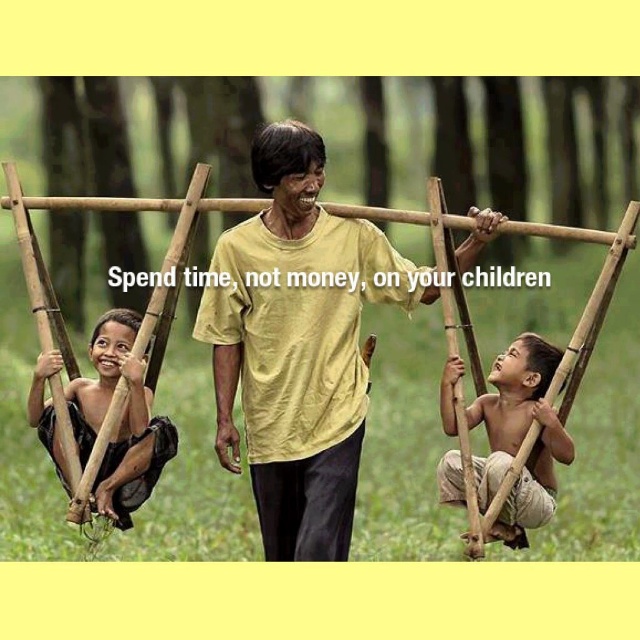
Can you confirm if brown skin child at center is thinner than black fabric child at left?

Correct, brown skin child at center's width is less than black fabric child at left's.

Between brown skin child at center and black fabric child at left, which one is positioned higher?

black fabric child at left is higher up.

Describe the element at coordinates (518, 436) in the screenshot. The width and height of the screenshot is (640, 640). I see `brown skin child at center` at that location.

This screenshot has height=640, width=640. Find the location of `brown skin child at center`. brown skin child at center is located at coordinates (518, 436).

Who is positioned more to the left, yellow cotton shirt at center or brown skin child at center?

From the viewer's perspective, yellow cotton shirt at center appears more on the left side.

Can you confirm if yellow cotton shirt at center is thinner than brown skin child at center?

In fact, yellow cotton shirt at center might be wider than brown skin child at center.

Consider the image. Who is more distant from viewer, (358, 374) or (547, 465)?

Point (358, 374)

In order to click on yellow cotton shirt at center in this screenshot , I will do `click(298, 344)`.

The height and width of the screenshot is (640, 640). Describe the element at coordinates (298, 344) in the screenshot. I see `yellow cotton shirt at center` at that location.

Which is more to the right, yellow cotton shirt at center or black fabric child at left?

yellow cotton shirt at center

This screenshot has height=640, width=640. What are the coordinates of `yellow cotton shirt at center` in the screenshot? It's located at click(x=298, y=344).

Image resolution: width=640 pixels, height=640 pixels. Find the location of `yellow cotton shirt at center`. yellow cotton shirt at center is located at coordinates (298, 344).